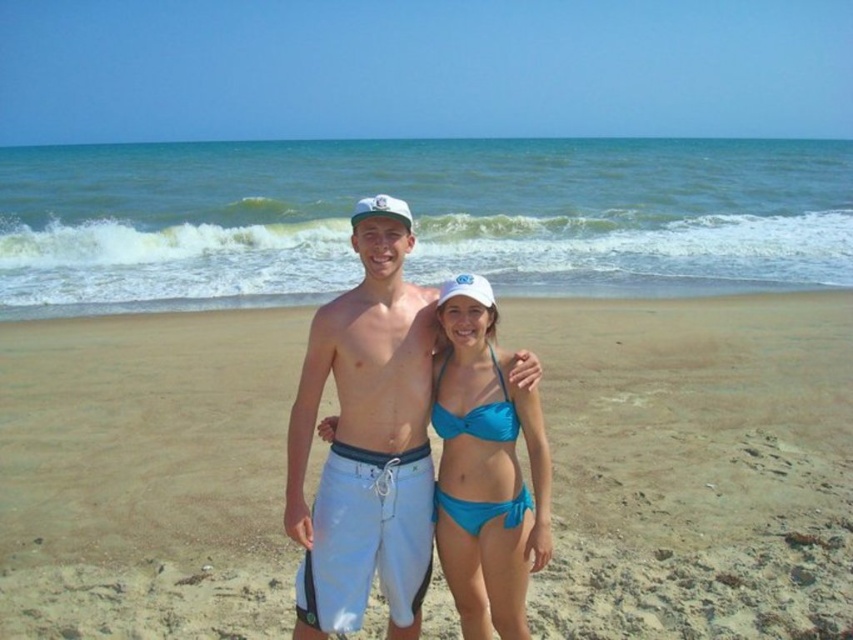
Is smooth sand at center below white cotton shorts at center?

Yes.

Can you confirm if smooth sand at center is positioned to the right of white cotton shorts at center?

Yes, smooth sand at center is to the right of white cotton shorts at center.

This screenshot has height=640, width=853. I want to click on smooth sand at center, so click(694, 465).

At what (x,y) coordinates should I click in order to perform the action: click on white cotton shorts at center. Please return your answer as a coordinate pair (x, y). The image size is (853, 640). Looking at the image, I should click on click(x=366, y=445).

Find the location of a particular element. white cotton shorts at center is located at coordinates (366, 445).

Is white cotton shorts at center in front of white matte baseball cap at center?

Yes, white cotton shorts at center is in front of white matte baseball cap at center.

Does white cotton shorts at center have a larger size compared to white matte baseball cap at center?

No.

In order to click on white cotton shorts at center in this screenshot , I will do `click(366, 445)`.

Locate an element on the screen. white cotton shorts at center is located at coordinates (366, 445).